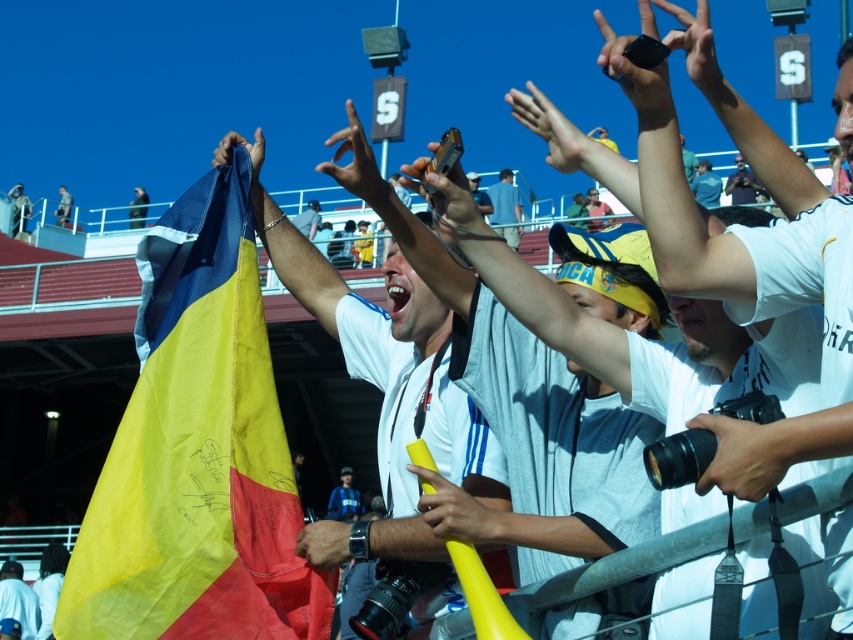
Who is taller, smooth black camera at center or matte yellow finger at center?

matte yellow finger at center

Who is positioned more to the right, smooth black camera at center or matte yellow finger at center?

smooth black camera at center

Describe the element at coordinates (749, 454) in the screenshot. I see `smooth black camera at center` at that location.

The height and width of the screenshot is (640, 853). I want to click on smooth black camera at center, so click(749, 454).

Does yellow rubber baton at center have a lesser width compared to yellow fabric flag at lower left?

Correct, yellow rubber baton at center's width is less than yellow fabric flag at lower left's.

Between yellow rubber baton at center and yellow fabric flag at lower left, which one appears on the left side from the viewer's perspective?

yellow fabric flag at lower left

Does point (502, 541) come farther from viewer compared to point (21, 582)?

No, it is in front of (21, 582).

The image size is (853, 640). Identify the location of yellow rubber baton at center. (465, 508).

Is smooth skin hand at upper center positioned at the back of blue fabric flag at upper center?

No, it is not.

Measure the distance between smooth skin hand at upper center and camera.

smooth skin hand at upper center and camera are 51.51 meters apart from each other.

This screenshot has height=640, width=853. I want to click on smooth skin hand at upper center, so click(550, 129).